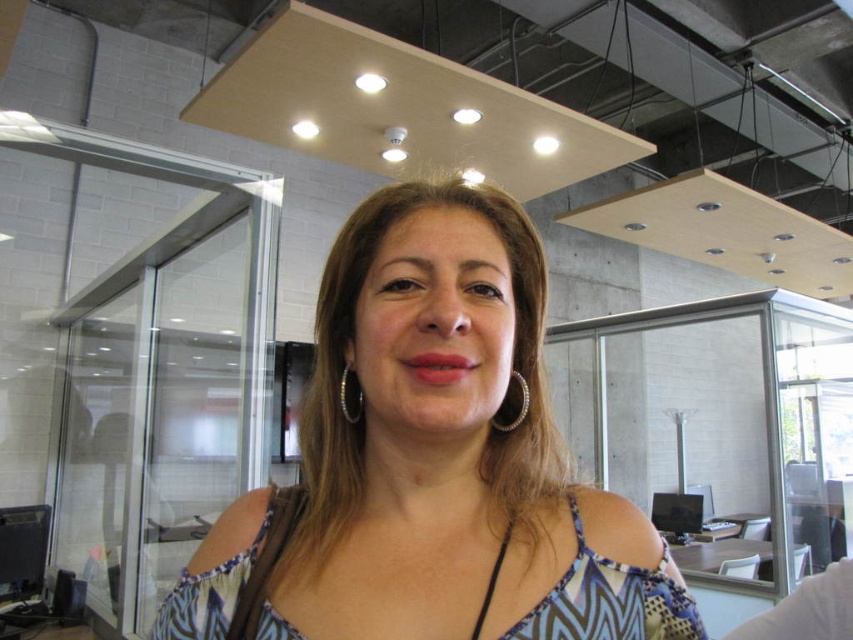
Does gold textured hoop at center come behind silver metallic earring at center?

No, gold textured hoop at center is in front of silver metallic earring at center.

Is point (523, 397) positioned before point (340, 396)?

No, (523, 397) is further to viewer.

Find the location of a particular element. gold textured hoop at center is located at coordinates (520, 406).

Looking at this image, does matte blue dress at center appear on the left side of gold textured hoop at center?

Indeed, matte blue dress at center is positioned on the left side of gold textured hoop at center.

Is matte blue dress at center to the right of gold textured hoop at center from the viewer's perspective?

No, matte blue dress at center is not to the right of gold textured hoop at center.

At what (x,y) coordinates should I click in order to perform the action: click on matte blue dress at center. Please return your answer as a coordinate pair (x, y). The image size is (853, 640). Looking at the image, I should click on (430, 461).

Is the position of matte blue dress at center less distant than that of silver metallic earring at center?

Yes.

The image size is (853, 640). Describe the element at coordinates (430, 461) in the screenshot. I see `matte blue dress at center` at that location.

Which is behind, point (314, 461) or point (361, 400)?

The point (314, 461) is behind.

This screenshot has width=853, height=640. What are the coordinates of `matte blue dress at center` in the screenshot? It's located at (430, 461).